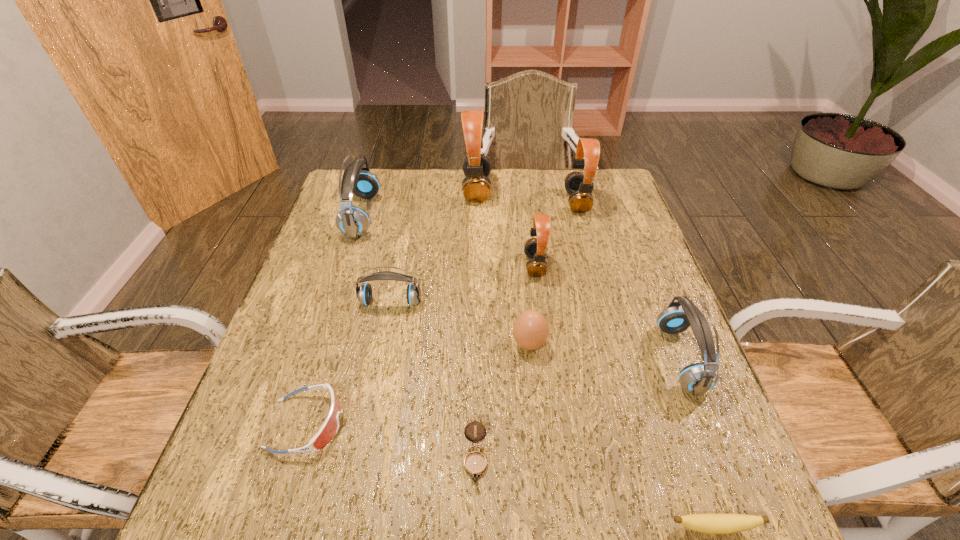
Identify the location of vacant region located on the ear cups of the second smallest brown headset. This screenshot has width=960, height=540. (508, 202).

This screenshot has width=960, height=540. I want to click on free space located 0.070m on the ear cups of the leftmost headset, so click(x=400, y=215).

Where is `vacant space located 0.270m on the ear cups of the fourth farthest headset`? Image resolution: width=960 pixels, height=540 pixels. vacant space located 0.270m on the ear cups of the fourth farthest headset is located at coordinates (422, 265).

Where is `vacant space situated 0.280m on the ear cups of the fourth farthest headset`? This screenshot has width=960, height=540. vacant space situated 0.280m on the ear cups of the fourth farthest headset is located at coordinates (419, 265).

The image size is (960, 540). Find the location of `vacant space located on the ear cups of the fourth farthest headset`. vacant space located on the ear cups of the fourth farthest headset is located at coordinates (422, 265).

This screenshot has height=540, width=960. I want to click on free space located on the ear cups of the rightmost headset, so click(479, 359).

Where is `vacant space situated on the ear cups of the rightmost headset`? vacant space situated on the ear cups of the rightmost headset is located at coordinates (488, 359).

The height and width of the screenshot is (540, 960). In order to click on free spot located on the ear cups of the rightmost headset in this screenshot , I will do tap(492, 359).

Where is `free space located 0.150m on the ear cups of the second farthest blue headset`? The image size is (960, 540). free space located 0.150m on the ear cups of the second farthest blue headset is located at coordinates (379, 363).

Locate an element on the screen. This screenshot has height=540, width=960. free space located 0.230m on the right of the brown boiled egg is located at coordinates (649, 344).